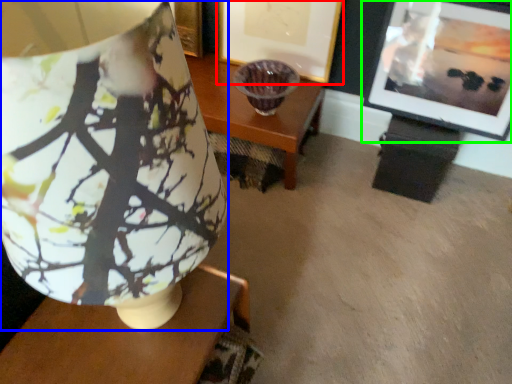
Question: Which object is the closest to the picture frame (highlighted by a red box)? Choose among these: lamp (highlighted by a blue box) or picture frame (highlighted by a green box).

Choices:
 (A) lamp
 (B) picture frame

Answer: (B)